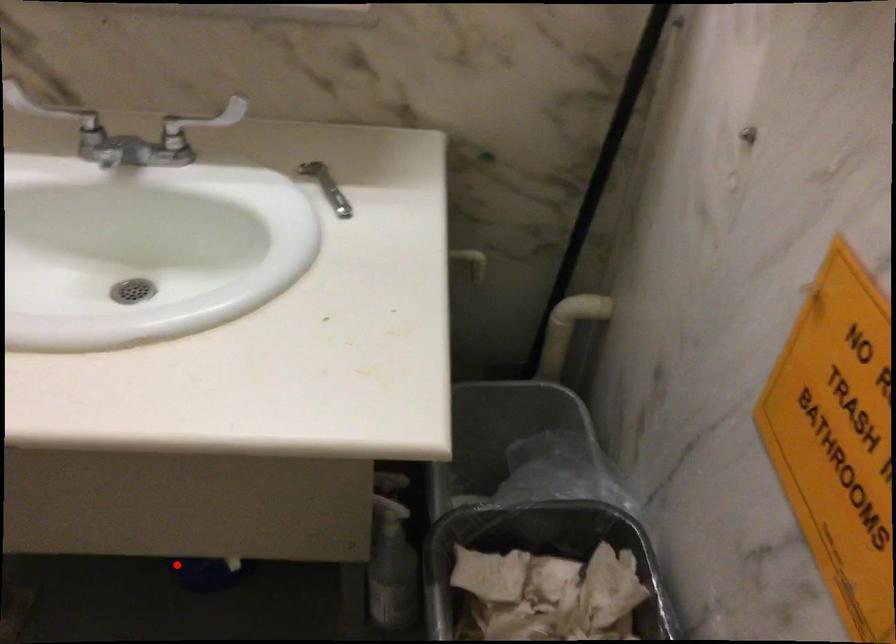
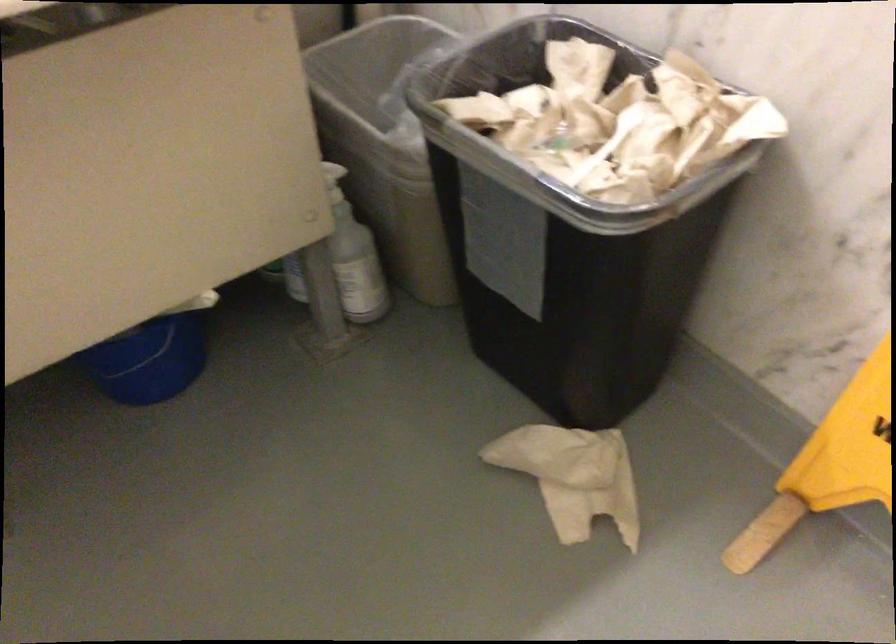
Question: A red point is marked in image1. In image2, is the corresponding 3D point closer to the camera or farther? Reply with the corresponding letter.

Choices:
 (A) The corresponding 3D point is closer.
 (B) The corresponding 3D point is farther.

Answer: (A)